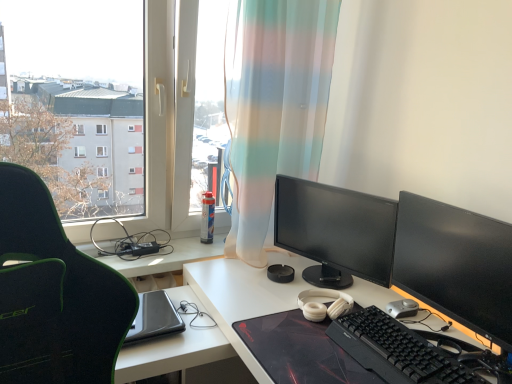
Question: Could you tell me if black plastic keyboard at lower right is facing silver metallic mouse at lower right?

Choices:
 (A) no
 (B) yes

Answer: (A)

Question: Does black plastic keyboard at lower right have a greater height compared to silver metallic mouse at lower right?

Choices:
 (A) yes
 (B) no

Answer: (A)

Question: Is black plastic keyboard at lower right looking in the opposite direction of silver metallic mouse at lower right?

Choices:
 (A) yes
 (B) no

Answer: (A)

Question: Does black plastic keyboard at lower right appear on the right side of silver metallic mouse at lower right?

Choices:
 (A) yes
 (B) no

Answer: (B)

Question: Can you confirm if black plastic keyboard at lower right is shorter than silver metallic mouse at lower right?

Choices:
 (A) no
 (B) yes

Answer: (A)

Question: In terms of width, does black plastic keyboard at lower right look wider or thinner when compared to silver metallic mouse at lower right?

Choices:
 (A) thin
 (B) wide

Answer: (B)

Question: Considering the positions of black plastic keyboard at lower right and silver metallic mouse at lower right in the image, is black plastic keyboard at lower right taller or shorter than silver metallic mouse at lower right?

Choices:
 (A) short
 (B) tall

Answer: (B)

Question: In terms of size, does black plastic keyboard at lower right appear bigger or smaller than silver metallic mouse at lower right?

Choices:
 (A) small
 (B) big

Answer: (B)

Question: Visually, is black plastic keyboard at lower right positioned to the left or to the right of silver metallic mouse at lower right?

Choices:
 (A) left
 (B) right

Answer: (A)

Question: Looking at their shapes, would you say black glossy monitor at right, the first computer monitor in the front-to-back sequence, is wider or thinner than white matte desk at center?

Choices:
 (A) thin
 (B) wide

Answer: (A)

Question: Considering the positions of point 470,311 and point 217,314, is point 470,311 closer or farther from the camera than point 217,314?

Choices:
 (A) farther
 (B) closer

Answer: (B)

Question: Is black glossy monitor at right, the second computer monitor viewed from the back, in front of or behind white matte desk at center in the image?

Choices:
 (A) front
 (B) behind

Answer: (B)

Question: From the image's perspective, is black glossy monitor at right, the first computer monitor in the front-to-back sequence, located above or below white matte desk at center?

Choices:
 (A) below
 (B) above

Answer: (B)

Question: Considering their positions, is black plastic keyboard at lower right located in front of or behind translucent fabric curtain at center?

Choices:
 (A) behind
 (B) front

Answer: (B)

Question: Would you say black plastic keyboard at lower right is inside or outside translucent fabric curtain at center?

Choices:
 (A) inside
 (B) outside

Answer: (B)